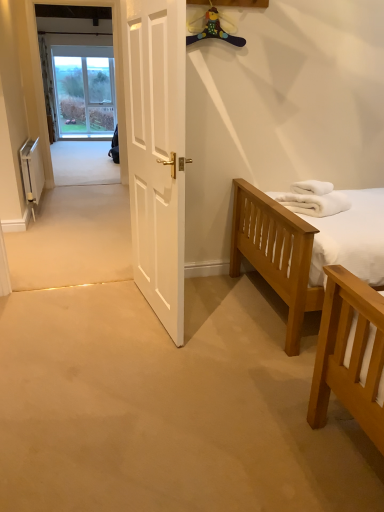
At what (x,y) coordinates should I click in order to perform the action: click on white matte door at center. Please return your answer as a coordinate pair (x, y). This screenshot has height=512, width=384. Looking at the image, I should click on (157, 151).

Locate an element on the screen. Image resolution: width=384 pixels, height=512 pixels. white metallic radiator at left is located at coordinates (32, 172).

What is the approximate height of white metallic radiator at left?

The height of white metallic radiator at left is 20.99 inches.

Find the location of a particular element. white matte door at center is located at coordinates (157, 151).

Is point (161, 150) closer to camera compared to point (19, 151)?

Yes, it is in front of point (19, 151).

Does white matte door at center come in front of white metallic radiator at left?

Yes, the depth of white matte door at center is less than that of white metallic radiator at left.

Are white matte door at center and white metallic radiator at left beside each other?

white matte door at center and white metallic radiator at left are not in contact.

Measure the distance from white matte door at center to white metallic radiator at left.

The distance of white matte door at center from white metallic radiator at left is 2.00 meters.

Where is `radiator behind the white fluffy towels at right`? The image size is (384, 512). radiator behind the white fluffy towels at right is located at coordinates [x=32, y=172].

How many degrees apart are the facing directions of white fluffy towels at right and white metallic radiator at left?

There is a 146-degree angle between the facing directions of white fluffy towels at right and white metallic radiator at left.

Is point (325, 183) less distant than point (38, 200)?

That is True.

Looking at this image, from the image's perspective, is white fluffy towels at right above or below white metallic radiator at left?

white fluffy towels at right is below white metallic radiator at left.

Between white metallic radiator at left and white fluffy towels at right, which one has less height?

Standing shorter between the two is white fluffy towels at right.

Is white metallic radiator at left facing towards white fluffy towels at right?

No.

How different are the orientations of white metallic radiator at left and white fluffy towels at right in degrees?

They differ by 146 degrees in their facing directions.

Is white metallic radiator at left far away from white fluffy towels at right?

white metallic radiator at left is far away from white fluffy towels at right.

Between white fluffy towels at right and white matte door at center, which one has smaller size?

white fluffy towels at right.

Is point (307, 189) positioned behind point (164, 100)?

Yes, it is.

Is white fluffy towels at right located outside white matte door at center?

Yes, white fluffy towels at right is located beyond the bounds of white matte door at center.

Is white fluffy towels at right with white matte door at center?

No, white fluffy towels at right is not beside white matte door at center.

Which of these two, white metallic radiator at left or white matte door at center, is thinner?

white matte door at center is thinner.

Based on their positions, is white metallic radiator at left located to the left or right of white matte door at center?

white metallic radiator at left is positioned on white matte door at center's left side.

Is white matte door at center surrounded by white metallic radiator at left?

No.

Between point (28, 153) and point (137, 10), which one is positioned in front?

The point (137, 10) is more forward.

Looking at this image, from their relative heights in the image, would you say white matte door at center is taller or shorter than white fluffy towels at right?

Considering their sizes, white matte door at center has more height than white fluffy towels at right.

Considering the sizes of objects white matte door at center and white fluffy towels at right in the image provided, who is smaller, white matte door at center or white fluffy towels at right?

white fluffy towels at right.

Is white fluffy towels at right completely or partially inside white matte door at center?

No, white fluffy towels at right is located outside of white matte door at center.

Between white matte door at center and white fluffy towels at right, which one has smaller width?

With smaller width is white matte door at center.

Identify the location of door below the white metallic radiator at left (from the image's perspective). (157, 151).

Where is `towel/napkin that appears above the white metallic radiator at left (from a real-world perspective)`? towel/napkin that appears above the white metallic radiator at left (from a real-world perspective) is located at coordinates (312, 187).

When comparing their distances from white metallic radiator at left, does white matte door at center or white fluffy towels at right seem closer?

white matte door at center.

When comparing their distances from white matte door at center, does white metallic radiator at left or white fluffy towels at right seem closer?

white fluffy towels at right lies closer to white matte door at center than the other object.

Looking at the image, which one is located closer to white matte door at center, white fluffy towels at right or white metallic radiator at left?

white fluffy towels at right.

Estimate the real-world distances between objects in this image. Which object is further from white fluffy towels at right, white metallic radiator at left or white matte door at center?

white metallic radiator at left is positioned further to the anchor white fluffy towels at right.

Considering their positions, is white matte door at center positioned closer to white fluffy towels at right than white metallic radiator at left?

white matte door at center.

Estimate the real-world distances between objects in this image. Which object is further from white metallic radiator at left, white fluffy towels at right or white matte door at center?

white fluffy towels at right is further to white metallic radiator at left.

Find the location of a particular element. This screenshot has height=512, width=384. door located between white metallic radiator at left and white fluffy towels at right in the left-right direction is located at coordinates (157, 151).